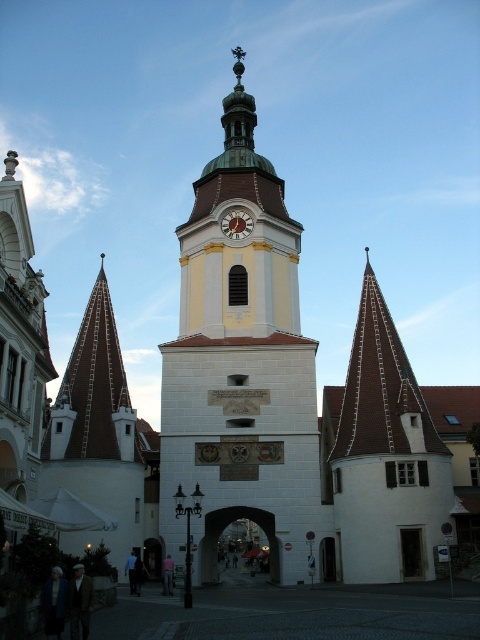
Question: Which point is farther to the camera?

Choices:
 (A) gold metallic clock at center
 (B) yellow stone clock tower at center

Answer: (A)

Question: Among these objects, which one is farthest from the camera?

Choices:
 (A) yellow stone clock tower at center
 (B) gold metallic clock at center

Answer: (B)

Question: Can you confirm if yellow stone clock tower at center is bigger than gold metallic clock at center?

Choices:
 (A) no
 (B) yes

Answer: (B)

Question: Which point is farther to the camera?

Choices:
 (A) (298, 422)
 (B) (251, 227)

Answer: (B)

Question: From the image, what is the correct spatial relationship of yellow stone clock tower at center in relation to gold metallic clock at center?

Choices:
 (A) above
 (B) below

Answer: (B)

Question: Does yellow stone clock tower at center appear over gold metallic clock at center?

Choices:
 (A) yes
 (B) no

Answer: (B)